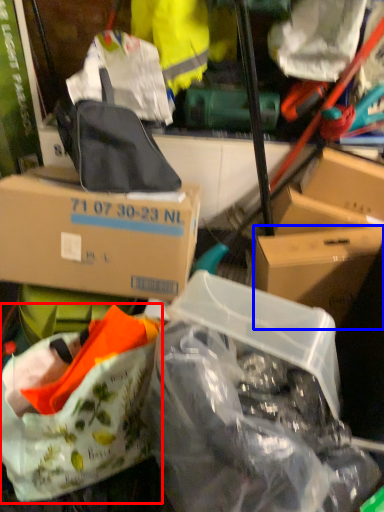
Question: Which object appears closest to the camera in this image, handbag (highlighted by a red box) or box (highlighted by a blue box)?

Choices:
 (A) handbag
 (B) box

Answer: (A)